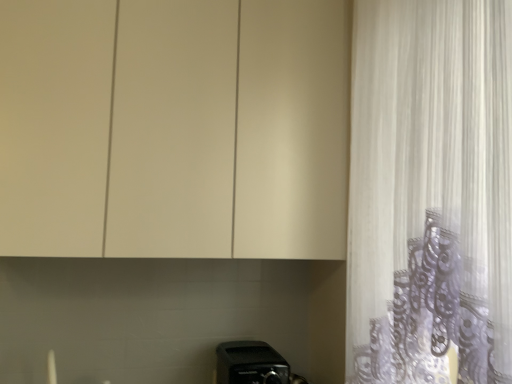
Question: Considering the relative sizes of white sheer curtain at right and matte white cabinet at upper center in the image provided, is white sheer curtain at right shorter than matte white cabinet at upper center?

Choices:
 (A) no
 (B) yes

Answer: (A)

Question: Is white sheer curtain at right in contact with matte white cabinet at upper center?

Choices:
 (A) no
 (B) yes

Answer: (A)

Question: Can you confirm if white sheer curtain at right is positioned to the left of matte white cabinet at upper center?

Choices:
 (A) no
 (B) yes

Answer: (A)

Question: From a real-world perspective, is white sheer curtain at right located higher than matte white cabinet at upper center?

Choices:
 (A) no
 (B) yes

Answer: (A)

Question: Is white sheer curtain at right turned away from matte white cabinet at upper center?

Choices:
 (A) no
 (B) yes

Answer: (A)

Question: Is white sheer curtain at right not within matte white cabinet at upper center?

Choices:
 (A) yes
 (B) no

Answer: (A)

Question: Is matte white cabinet at upper center to the left of white sheer curtain at right from the viewer's perspective?

Choices:
 (A) yes
 (B) no

Answer: (A)

Question: Is matte white cabinet at upper center facing towards white sheer curtain at right?

Choices:
 (A) no
 (B) yes

Answer: (B)

Question: Considering the relative sizes of matte white cabinet at upper center and white sheer curtain at right in the image provided, is matte white cabinet at upper center bigger than white sheer curtain at right?

Choices:
 (A) yes
 (B) no

Answer: (A)

Question: From the image's perspective, does matte white cabinet at upper center appear higher than white sheer curtain at right?

Choices:
 (A) yes
 (B) no

Answer: (A)

Question: Is matte white cabinet at upper center closer to camera compared to white sheer curtain at right?

Choices:
 (A) yes
 (B) no

Answer: (B)

Question: Can you confirm if matte white cabinet at upper center is smaller than white sheer curtain at right?

Choices:
 (A) yes
 (B) no

Answer: (B)

Question: Is black plastic toaster at lower center smaller than matte white cabinet at upper center?

Choices:
 (A) yes
 (B) no

Answer: (A)